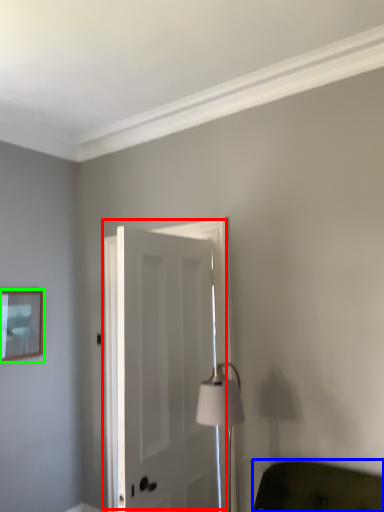
Question: Which object is the closest to the door (highlighted by a red box)? Choose among these: furniture (highlighted by a blue box) or picture frame (highlighted by a green box).

Choices:
 (A) furniture
 (B) picture frame

Answer: (A)